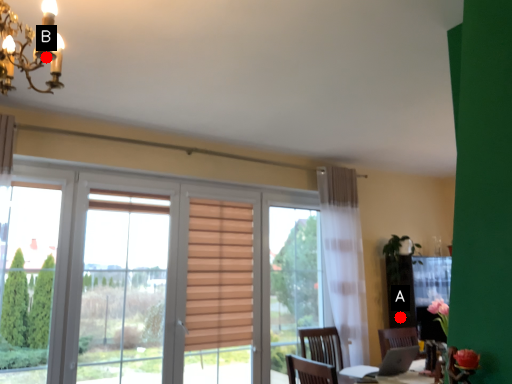
Question: Two points are circled on the image, labeled by A and B beside each circle. Which of the following is the farthest from the observer?

Choices:
 (A) A is further
 (B) B is further

Answer: (A)